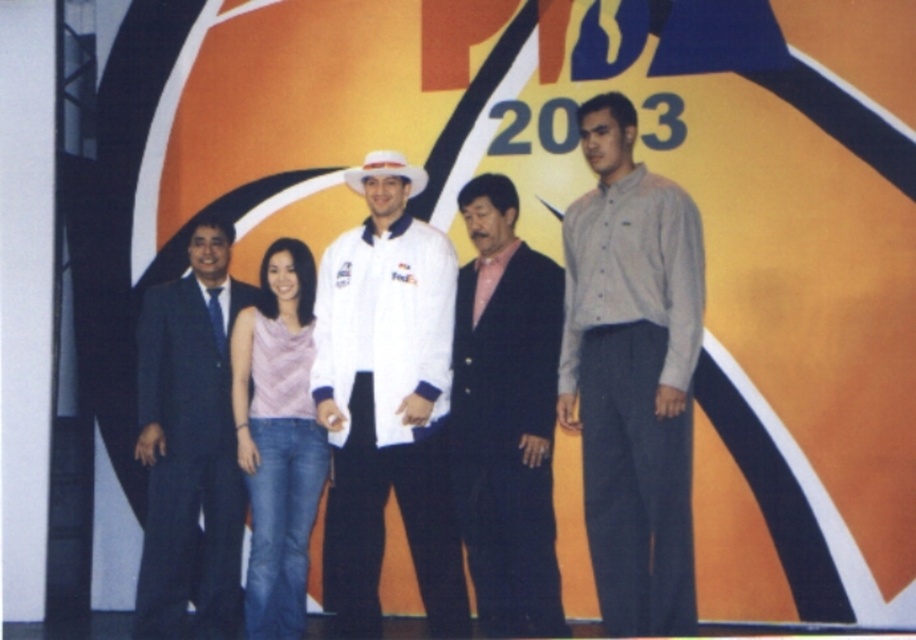
Question: Can you confirm if gray cotton shirt at right is wider than white matte jacket at center?

Choices:
 (A) no
 (B) yes

Answer: (A)

Question: Estimate the real-world distances between objects in this image. Which object is closer to the pink fabric top at center?

Choices:
 (A) dark blue suit at left
 (B) pink satin shirt at center
 (C) white matte jacket at center
 (D) gray cotton shirt at right

Answer: (C)

Question: Which point is closer to the camera?

Choices:
 (A) pink satin shirt at center
 (B) pink fabric top at center
 (C) dark blue suit at left

Answer: (A)

Question: Is gray cotton shirt at right wider than white matte jacket at center?

Choices:
 (A) yes
 (B) no

Answer: (B)

Question: Which object is the closest to the pink satin shirt at center?

Choices:
 (A) dark blue suit at left
 (B) pink fabric top at center
 (C) gray cotton shirt at right
 (D) white matte jacket at center

Answer: (D)

Question: Is pink satin shirt at center behind dark blue suit at left?

Choices:
 (A) yes
 (B) no

Answer: (B)